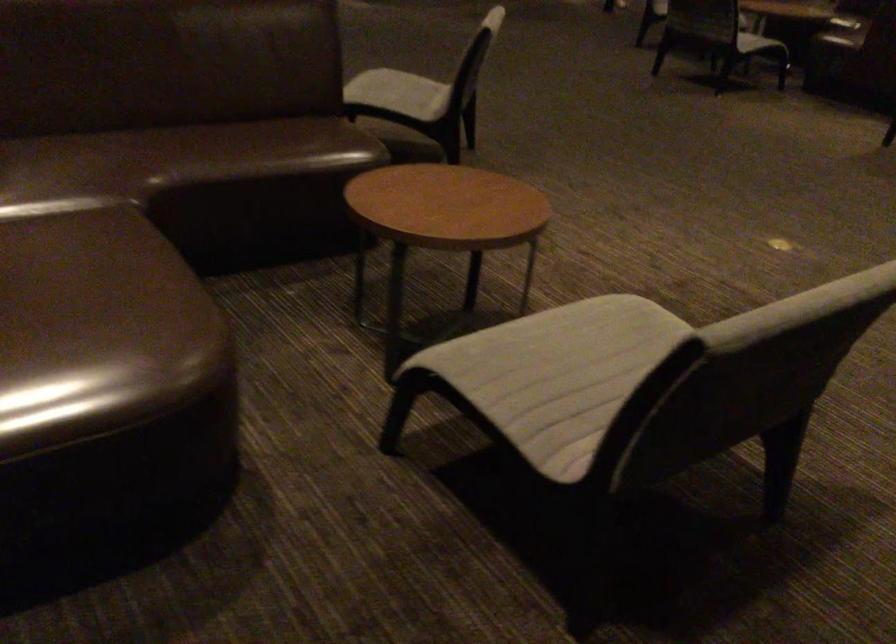
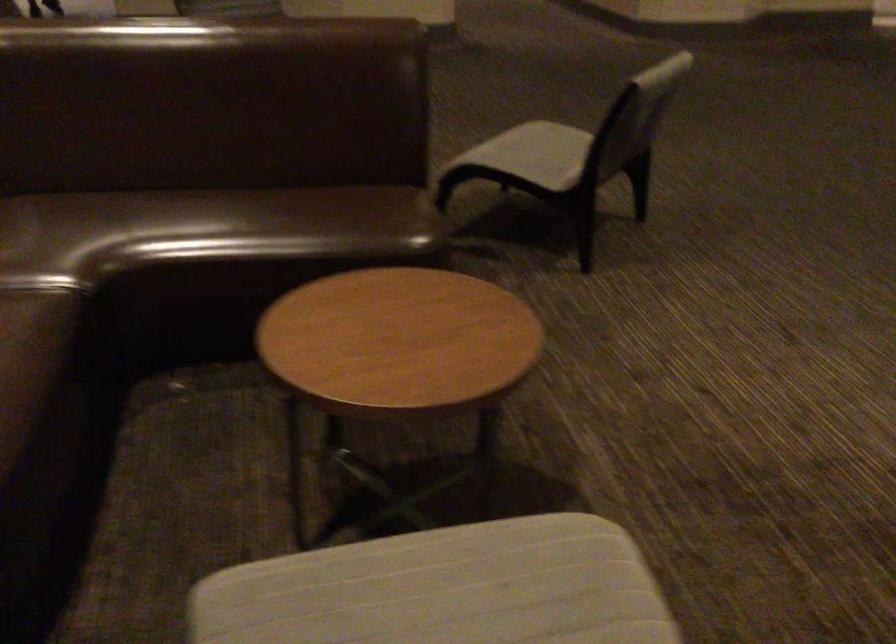
Where in the second image is the point corresponding to the point at 565,339 from the first image?

(444, 589)